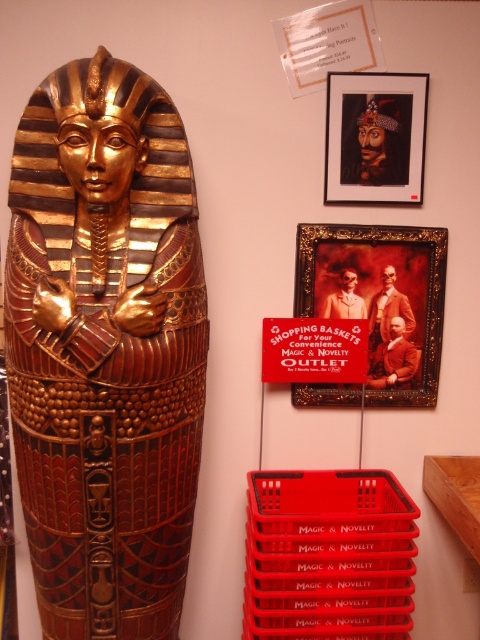
You are organizing a storage space and need to place the red plastic crate at lower right and the matte black portrait at upper center. Given their sizes, which object can hold more items inside?

The red plastic crate at lower right has a larger width than the matte black portrait at upper center, so it can hold more items inside.

You are organizing a storage space and need to place the red plastic crate at lower right and the matte black portrait at upper center. Which object requires more space due to its size?

The red plastic crate at lower right requires more space because it is bigger than the matte black portrait at upper center.